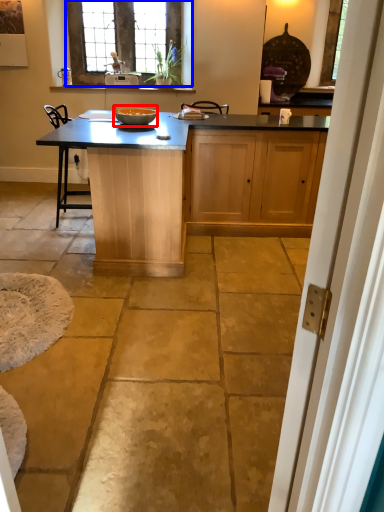
Question: Among these objects, which one is farthest to the camera, bowl (highlighted by a red box) or window (highlighted by a blue box)?

Choices:
 (A) bowl
 (B) window

Answer: (B)